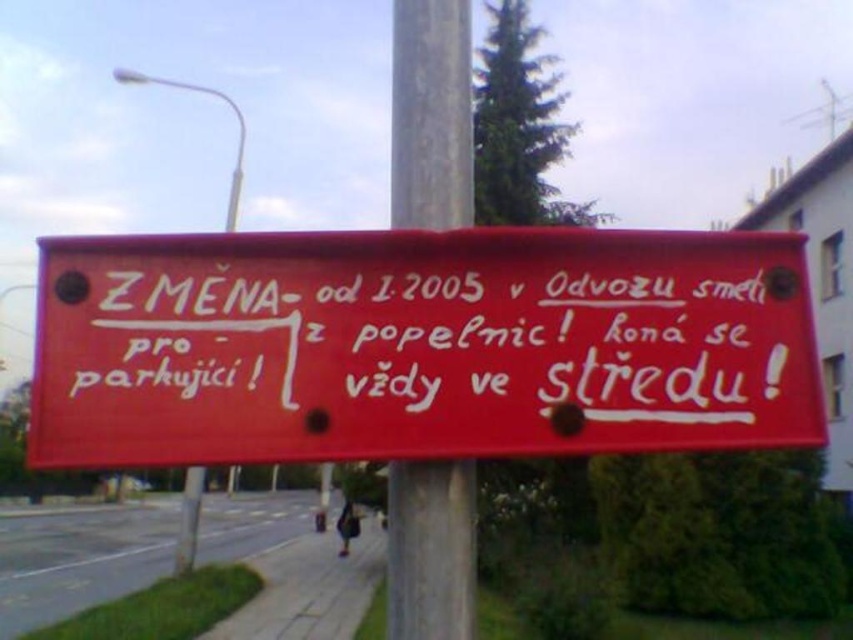
You are a delivery driver who needs to attach a package to the pole. You see both the smooth gray pole at center and the metallic pole at center. Which pole should you choose if you want to place the package higher up?

The smooth gray pole at center is located above the metallic pole at center, so you should choose the smooth gray pole at center to place the package higher up.

You are standing at point A located at point [670,429]. You need to walk to point B, which is 1.33 meters away from you. Can you reach point B within 2 steps if each step you take is 0.7 meters long?

The distance between point A and point B is 1.33 meters. Each step you take is 0.7 meters long. Taking two steps would cover 1.4 meters, which is slightly more than the required distance. Therefore, you can reach point B within 2 steps.